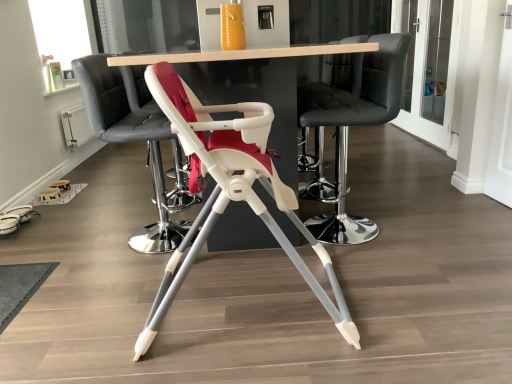
Question: Considering the relative positions of wooden table at center and black leather bar stool at center, placed as the 4th chair when sorted from front to back, in the image provided, is wooden table at center to the left or to the right of black leather bar stool at center, placed as the 4th chair when sorted from front to back,?

Choices:
 (A) right
 (B) left

Answer: (B)

Question: From the image's perspective, relative to black leather bar stool at center, placed as the 4th chair when sorted from front to back, is wooden table at center above or below?

Choices:
 (A) below
 (B) above

Answer: (A)

Question: Which object is the closest to the clear glass window screen at upper left?

Choices:
 (A) white plastic highchair at center, which is the first chair in front-to-back order
 (B) white plastic highchair at center, which appears as the second chair when viewed from the back
 (C) wooden table at center
 (D) black leather bar stool at center, placed as the 2th chair when sorted from front to back
 (E) black leather bar stool at center, placed as the 4th chair when sorted from front to back

Answer: (B)

Question: Based on their relative distances, which object is farther from the black leather bar stool at center, the first chair from the back?

Choices:
 (A) clear glass window screen at upper left
 (B) wooden table at center
 (C) white plastic highchair at center, positioned as the fourth chair in back-to-front order
 (D) white plastic highchair at center, which appears as the second chair when viewed from the back
 (E) black leather bar stool at center, arranged as the 3th chair when viewed from the back

Answer: (A)